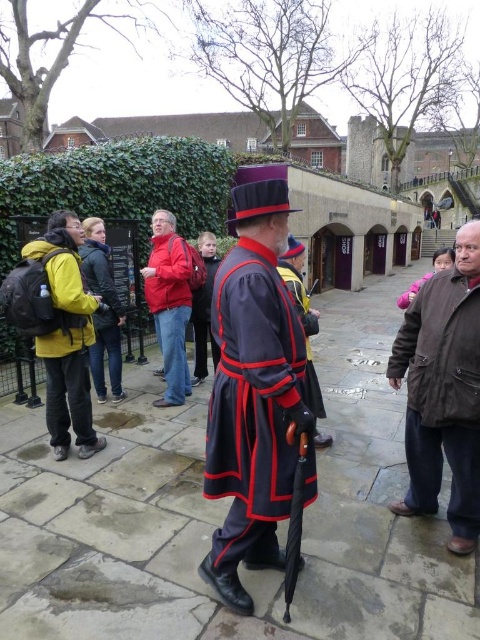
Does red fabric jacket at center lie in front of velvet-like dark blue robe at center?

That is False.

Is red fabric jacket at center below velvet-like dark blue robe at center?

Correct, red fabric jacket at center is located below velvet-like dark blue robe at center.

Looking at this image, who is more forward, (x=168, y=289) or (x=309, y=348)?

Point (x=309, y=348)

At what (x,y) coordinates should I click in order to perform the action: click on red fabric jacket at center. Please return your answer as a coordinate pair (x, y). This screenshot has width=480, height=640. Looking at the image, I should click on (170, 301).

Is the position of matte black robe at center more distant than that of velvet-like dark gray robe at center?

No, it is in front of velvet-like dark gray robe at center.

Does matte black robe at center have a greater height compared to velvet-like dark gray robe at center?

Yes, matte black robe at center is taller than velvet-like dark gray robe at center.

Identify the location of matte black robe at center. (103, 314).

Which is in front, point (432, 342) or point (61, 308)?

Point (432, 342)

Can you confirm if brown wool coat at right is thinner than yellow matte jacket at left?

Correct, brown wool coat at right's width is less than yellow matte jacket at left's.

Does point (429, 337) come behind point (66, 445)?

That is False.

Where is `brown wool coat at right`? The height and width of the screenshot is (640, 480). brown wool coat at right is located at coordinates (444, 392).